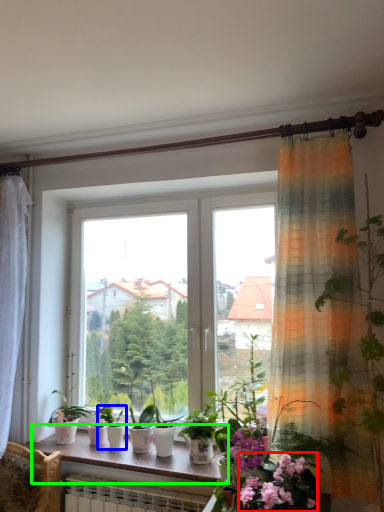
Question: Considering the real-world distances, which object is farthest from flower (highlighted by a red box)? houseplant (highlighted by a blue box) or window sill (highlighted by a green box)?

Choices:
 (A) houseplant
 (B) window sill

Answer: (A)